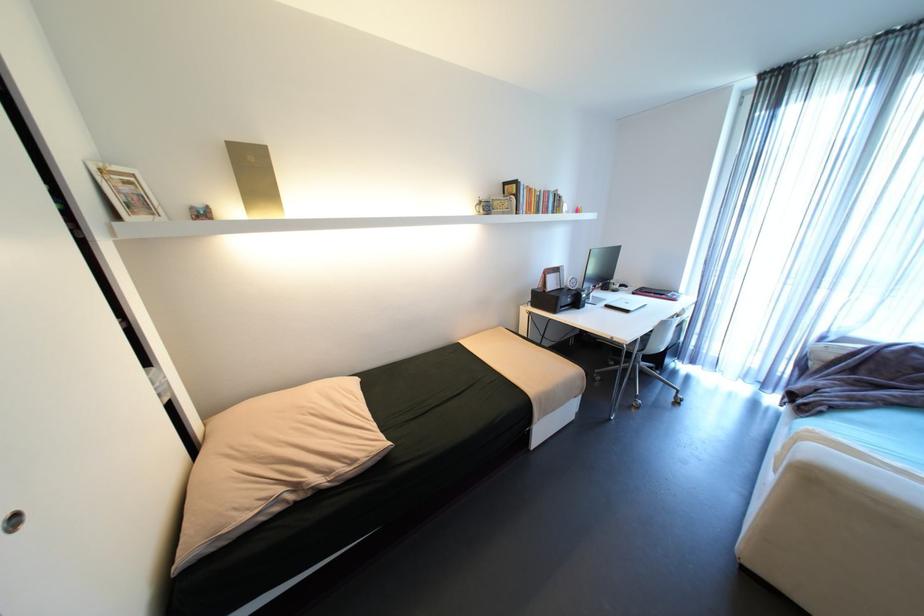
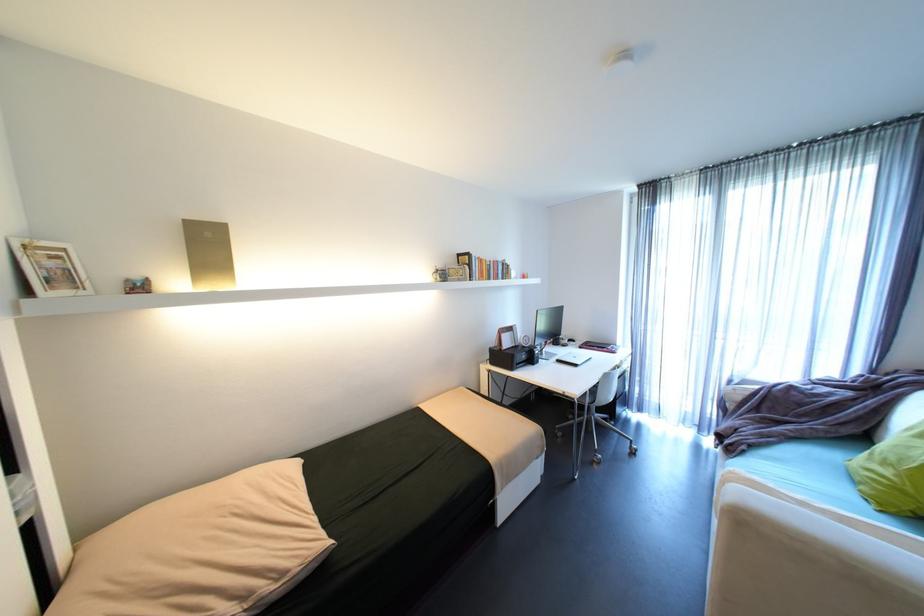
In a continuous first-person perspective shot, in which direction is the camera moving?

The movement direction of the cameraman is right, backward.